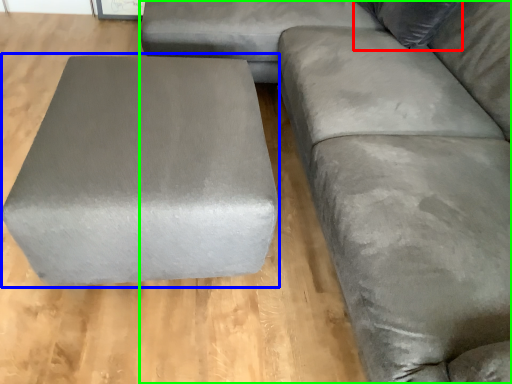
Question: Based on their relative distances, which object is nearer to pillow (highlighted by a red box)? Choose from stool (highlighted by a blue box) and studio couch (highlighted by a green box).

Choices:
 (A) stool
 (B) studio couch

Answer: (B)